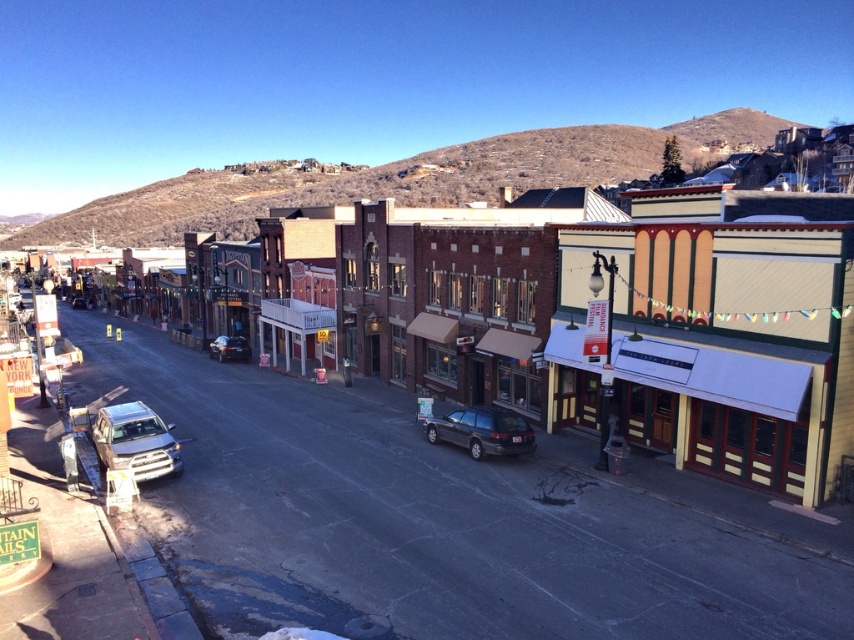
Question: Does yellow corrugated metal building at center-right lie in front of metallic silver sedan at center?

Choices:
 (A) no
 (B) yes

Answer: (B)

Question: Where is yellow corrugated metal building at center-right located in relation to metallic silver sedan at center in the image?

Choices:
 (A) below
 (B) above

Answer: (B)

Question: Does satin silver suv at lower left have a smaller size compared to satin silver sedan at center?

Choices:
 (A) yes
 (B) no

Answer: (A)

Question: Among these objects, which one is nearest to the camera?

Choices:
 (A) satin silver sedan at center
 (B) dark gray matte station wagon at center

Answer: (B)

Question: Among these points, which one is farthest from the camera?

Choices:
 (A) (167, 464)
 (B) (752, 252)

Answer: (A)

Question: Which point is farther to the camera?

Choices:
 (A) dark gray matte station wagon at center
 (B) satin silver sedan at center

Answer: (B)